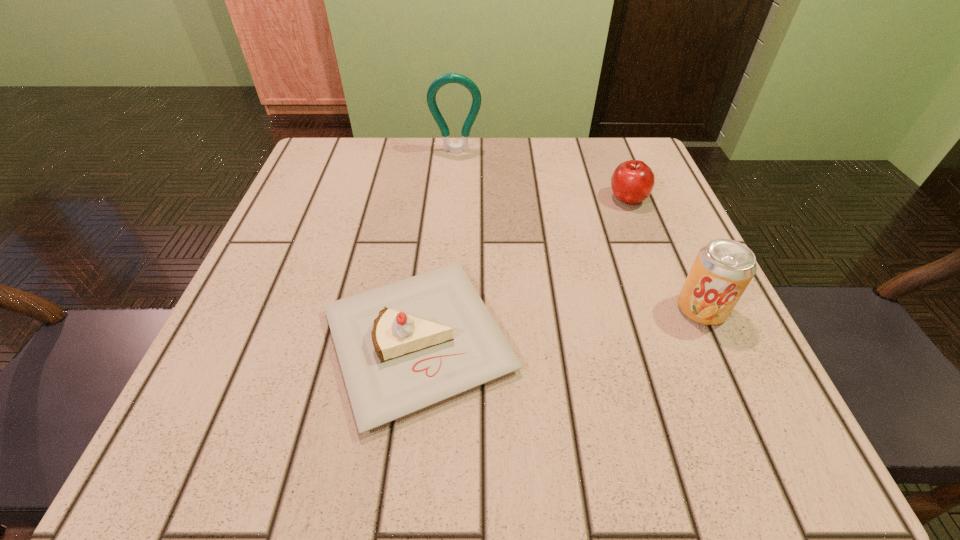
I want to click on vacant area that satisfies the following two spatial constraints: 1. on the back side of the apple; 2. on the left side of the shortest object, so click(435, 198).